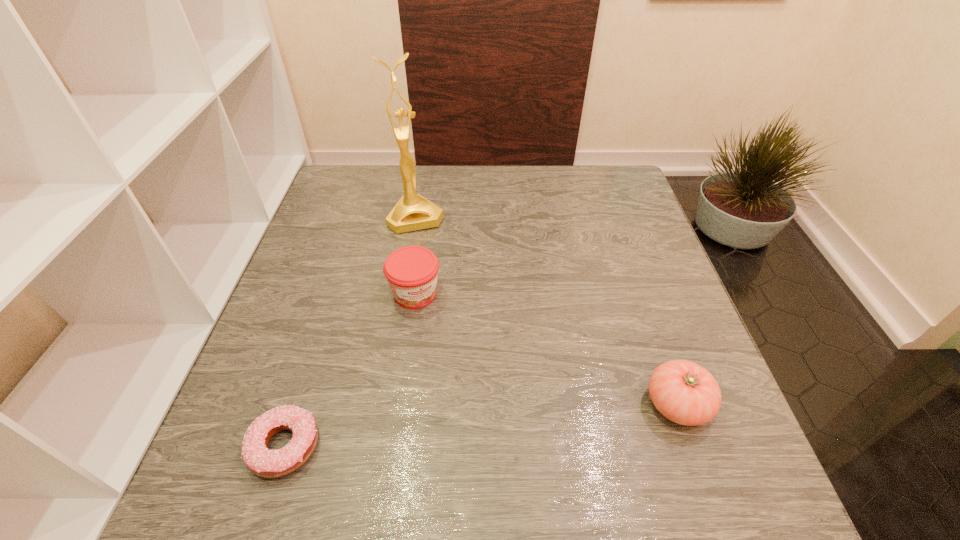
Identify the location of free space on the desktop that is between the leftmost object and the tomato and is positioned on the label side of the third nearest object. (492, 424).

Find the location of `free space on the desktop that is between the shortest object and the rightmost object and is positioned on the front-facing side of the farthest object`. free space on the desktop that is between the shortest object and the rightmost object and is positioned on the front-facing side of the farthest object is located at coordinates (493, 424).